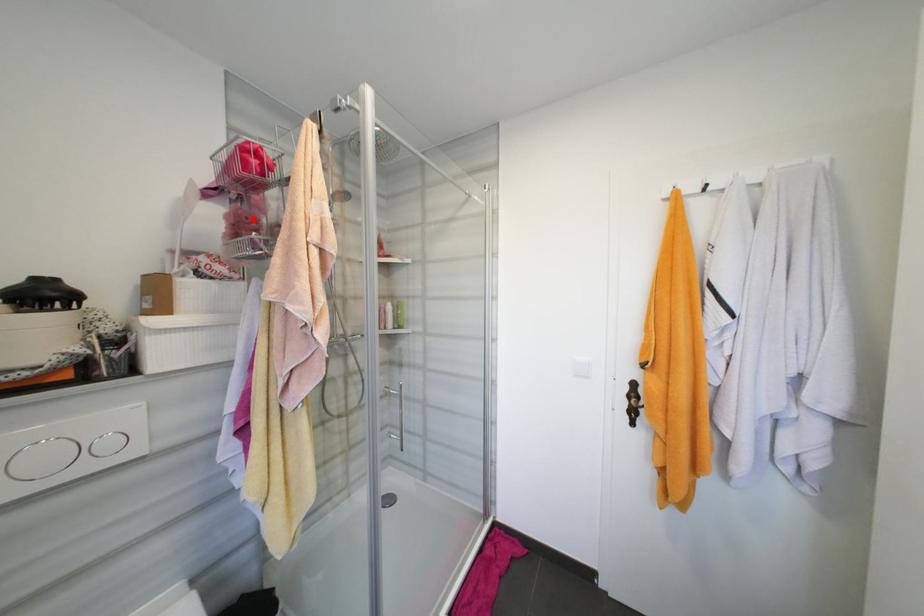
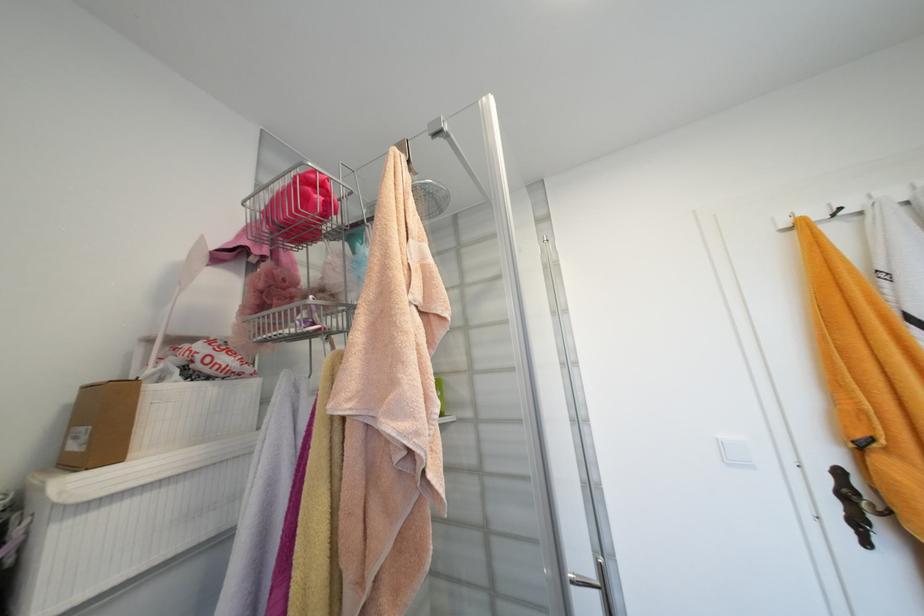
Locate, in the second image, the point that corresponds to the highlighted location in the first image.

(289, 282)